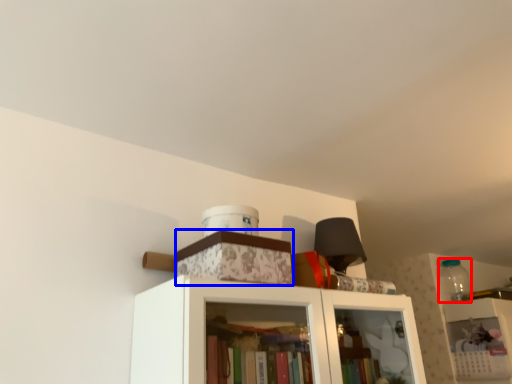
Question: Which object is closer to the camera taking this photo, bottle (highlighted by a red box) or cabinetry (highlighted by a blue box)?

Choices:
 (A) bottle
 (B) cabinetry

Answer: (B)